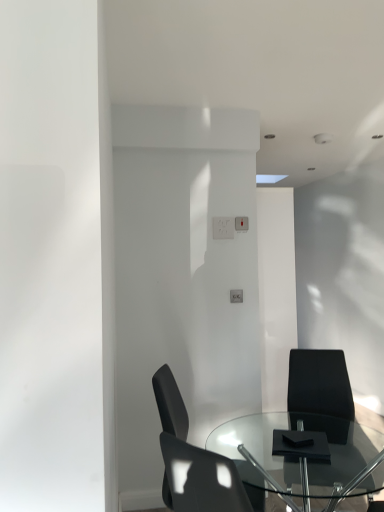
Question: Can you confirm if transparent glass table at center is bigger than matte black chair at lower center, which is the 2th chair in right-to-left order?

Choices:
 (A) no
 (B) yes

Answer: (B)

Question: Considering the relative positions of transparent glass table at center and matte black chair at lower center, arranged as the 1th chair when viewed from the left, in the image provided, is transparent glass table at center in front of matte black chair at lower center, arranged as the 1th chair when viewed from the left,?

Choices:
 (A) no
 (B) yes

Answer: (B)

Question: Is transparent glass table at center thinner than matte black chair at lower center, arranged as the 1th chair when viewed from the left?

Choices:
 (A) yes
 (B) no

Answer: (B)

Question: Would you say transparent glass table at center is outside matte black chair at lower center, which is the 2th chair in right-to-left order?

Choices:
 (A) no
 (B) yes

Answer: (B)

Question: From a real-world perspective, is transparent glass table at center located higher than matte black chair at lower center, which is the 2th chair in right-to-left order?

Choices:
 (A) no
 (B) yes

Answer: (A)

Question: Is transparent glass table at center next to matte black chair at lower center, arranged as the 1th chair when viewed from the left, and touching it?

Choices:
 (A) yes
 (B) no

Answer: (B)

Question: Is black matte chair at lower right, acting as the first chair starting from the right, not inside transparent glass table at center?

Choices:
 (A) yes
 (B) no

Answer: (B)

Question: Would you consider black matte chair at lower right, placed as the 2th chair when sorted from left to right, to be distant from transparent glass table at center?

Choices:
 (A) yes
 (B) no

Answer: (B)

Question: From the image's perspective, would you say black matte chair at lower right, acting as the first chair starting from the right, is positioned over transparent glass table at center?

Choices:
 (A) no
 (B) yes

Answer: (B)

Question: Is black matte chair at lower right, placed as the 2th chair when sorted from left to right, wider than transparent glass table at center?

Choices:
 (A) no
 (B) yes

Answer: (A)

Question: Considering the relative positions of black matte chair at lower right, acting as the first chair starting from the right, and transparent glass table at center in the image provided, is black matte chair at lower right, acting as the first chair starting from the right, to the left of transparent glass table at center from the viewer's perspective?

Choices:
 (A) yes
 (B) no

Answer: (B)

Question: Considering the relative positions of black matte chair at lower right, acting as the first chair starting from the right, and transparent glass table at center in the image provided, is black matte chair at lower right, acting as the first chair starting from the right, behind transparent glass table at center?

Choices:
 (A) no
 (B) yes

Answer: (B)

Question: Is the position of black matte chair at lower right, acting as the first chair starting from the right, less distant than that of matte black chair at lower center, which is the 2th chair in right-to-left order?

Choices:
 (A) yes
 (B) no

Answer: (B)